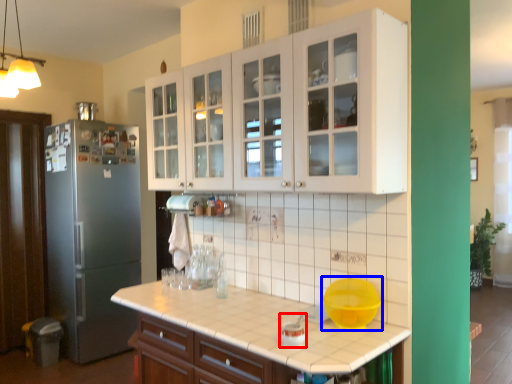
Question: Which object appears farthest to the camera in this image, appliance (highlighted by a red box) or mixing bowl (highlighted by a blue box)?

Choices:
 (A) appliance
 (B) mixing bowl

Answer: (B)